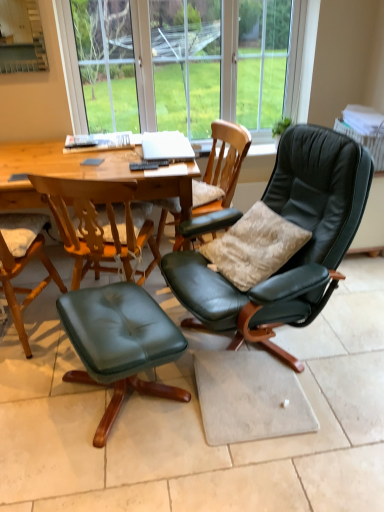
Question: Should I look upward or downward to see matte green leather chair at lower left, the 3th chair in the right-to-left sequence?

Choices:
 (A) down
 (B) up

Answer: (B)

Question: From the image's perspective, does wooden round table at center appear higher than transparent glass bay window at upper center?

Choices:
 (A) yes
 (B) no

Answer: (B)

Question: Is wooden round table at center smaller than transparent glass bay window at upper center?

Choices:
 (A) no
 (B) yes

Answer: (A)

Question: Is the position of wooden round table at center less distant than that of transparent glass bay window at upper center?

Choices:
 (A) yes
 (B) no

Answer: (A)

Question: Is transparent glass bay window at upper center at the back of wooden round table at center?

Choices:
 (A) yes
 (B) no

Answer: (B)

Question: Is wooden round table at center with transparent glass bay window at upper center?

Choices:
 (A) no
 (B) yes

Answer: (A)

Question: Does wooden round table at center appear on the left side of transparent glass bay window at upper center?

Choices:
 (A) yes
 (B) no

Answer: (A)

Question: From the image's perspective, does green leather ottoman at lower left appear lower than velvet beige pillow at center right?

Choices:
 (A) yes
 (B) no

Answer: (A)

Question: Is green leather ottoman at lower left directly adjacent to velvet beige pillow at center right?

Choices:
 (A) yes
 (B) no

Answer: (B)

Question: Is velvet beige pillow at center right inside green leather ottoman at lower left?

Choices:
 (A) yes
 (B) no

Answer: (B)

Question: Is the position of green leather ottoman at lower left more distant than that of velvet beige pillow at center right?

Choices:
 (A) no
 (B) yes

Answer: (A)

Question: Is green leather ottoman at lower left to the right of velvet beige pillow at center right from the viewer's perspective?

Choices:
 (A) no
 (B) yes

Answer: (A)

Question: Can you confirm if green leather ottoman at lower left is smaller than velvet beige pillow at center right?

Choices:
 (A) yes
 (B) no

Answer: (B)

Question: Can you confirm if matte black leather chair at center, the 1th chair viewed from the right, is smaller than matte green leather chair at lower left, acting as the 1th chair starting from the left?

Choices:
 (A) yes
 (B) no

Answer: (B)